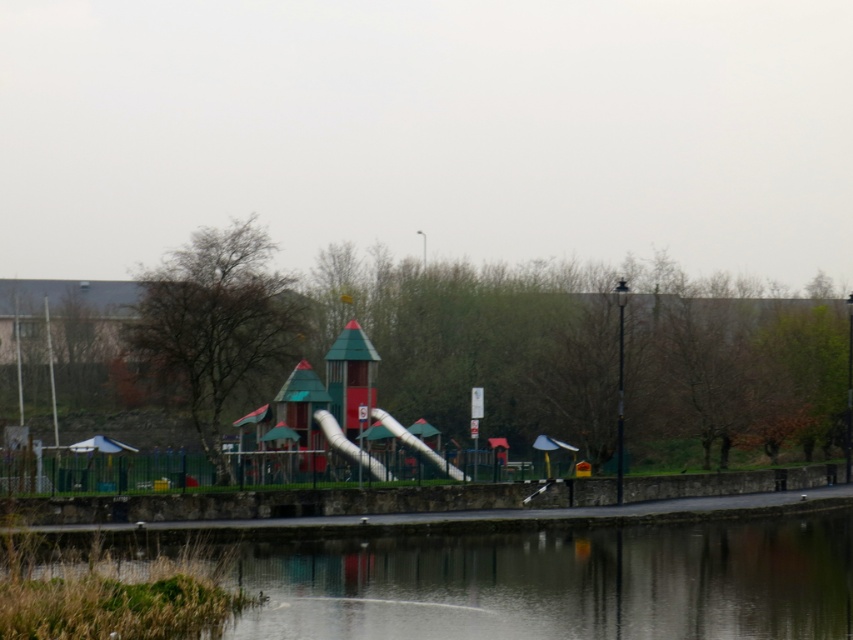
You are standing at point (x=379, y=419) and want to walk towards the playground structure. Is the point (x=381, y=541) located in front of or behind your current position relative to the playground structure?

Point (x=381, y=541) is in front of point (x=379, y=419), so it is located in front of your current position relative to the playground structure.

You are a parent trying to ensure your child can safely play on the playground. You see the transparent glass water at center and the white plastic slide at center. Which object is higher in the image?

The transparent glass water at center is much taller than the white plastic slide at center, so the transparent glass water at center is higher in the image.